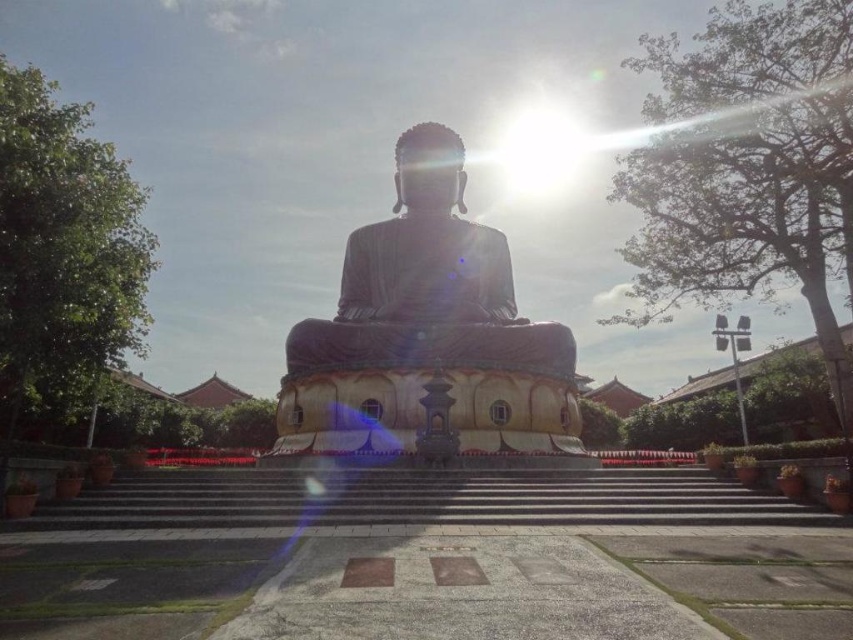
Is point (614, 483) farther from camera compared to point (508, 268)?

That is False.

Who is more forward, [155,506] or [451,288]?

Positioned in front is point [155,506].

Is point (328, 513) more distant than point (461, 186)?

No.

You are a GUI agent. You are given a task and a screenshot of the screen. Output one action in this format:
    pyautogui.click(x=<x>, y=<y>)
    Task: Click on the dark gray concrete stairs at center
    
    Given the screenshot: What is the action you would take?
    pyautogui.click(x=422, y=499)

Who is more forward, (364, 380) or (434, 163)?

Positioned in front is point (364, 380).

Who is more forward, (287,404) or (457,164)?

Positioned in front is point (287,404).

This screenshot has width=853, height=640. Find the location of `black polished stone statue at center`. black polished stone statue at center is located at coordinates (427, 332).

Does black polished stone statue at center have a greater width compared to dark gray concrete stairs at center?

In fact, black polished stone statue at center might be narrower than dark gray concrete stairs at center.

Which is below, black polished stone statue at center or dark gray concrete stairs at center?

dark gray concrete stairs at center is below.

Between point (538, 413) and point (415, 488), which one is positioned in front?

Point (415, 488) is more forward.

Identify the location of black polished stone statue at center. (427, 332).